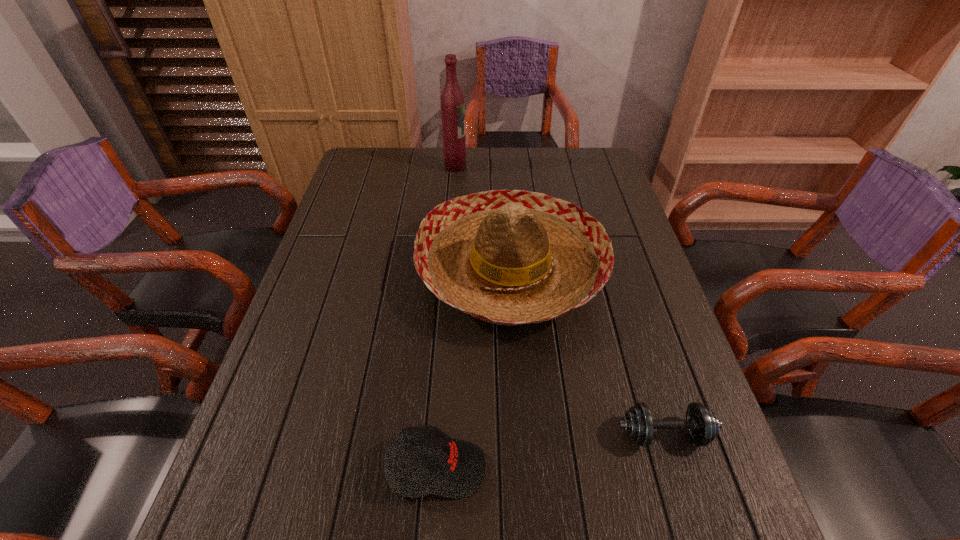
The height and width of the screenshot is (540, 960). I want to click on vacant space that satisfies the following two spatial constraints: 1. on the label of the farthest object; 2. on the left side of the second tallest object, so click(447, 269).

Identify the location of free spot that satisfies the following two spatial constraints: 1. on the label of the tallest object; 2. on the left side of the dumbbell. (436, 434).